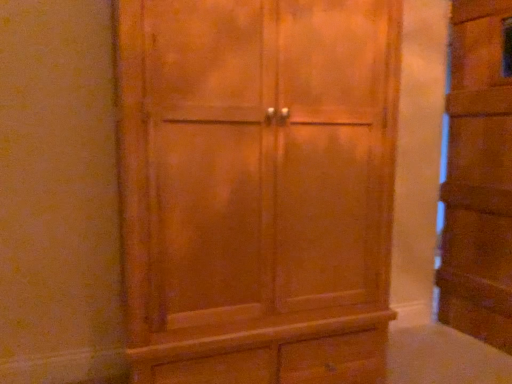
The width and height of the screenshot is (512, 384). Describe the element at coordinates (257, 188) in the screenshot. I see `matte wood cupboard at center, which is counted as the 1th cupboard, starting from the left` at that location.

This screenshot has width=512, height=384. I want to click on matte wood cupboard at center, which is counted as the 1th cupboard, starting from the left, so click(257, 188).

What is the approximate width of matte wood cupboard at center, which is counted as the 1th cupboard, starting from the left?

The width of matte wood cupboard at center, which is counted as the 1th cupboard, starting from the left, is 24.07 inches.

What is the approximate height of wooden cabinet at right, placed as the 1th cupboard when sorted from right to left?

wooden cabinet at right, placed as the 1th cupboard when sorted from right to left, is 1.79 meters in height.

You are a GUI agent. You are given a task and a screenshot of the screen. Output one action in this format:
    pyautogui.click(x=<x>, y=<y>)
    Task: Click on the wooden cabinet at right, placed as the second cupboard when sorted from left to right
    This screenshot has height=384, width=512.
    Given the screenshot: What is the action you would take?
    pyautogui.click(x=479, y=176)

This screenshot has height=384, width=512. What do you see at coordinates (479, 176) in the screenshot?
I see `wooden cabinet at right, placed as the second cupboard when sorted from left to right` at bounding box center [479, 176].

Identify the location of matte wood cupboard at center, acting as the 2th cupboard starting from the right. The height and width of the screenshot is (384, 512). (257, 188).

Can you confirm if matte wood cupboard at center, which is counted as the 1th cupboard, starting from the left, is positioned to the left of wooden cabinet at right, placed as the 1th cupboard when sorted from right to left?

Correct, you'll find matte wood cupboard at center, which is counted as the 1th cupboard, starting from the left, to the left of wooden cabinet at right, placed as the 1th cupboard when sorted from right to left.

Who is more distant, matte wood cupboard at center, which is counted as the 1th cupboard, starting from the left, or wooden cabinet at right, placed as the 1th cupboard when sorted from right to left?

wooden cabinet at right, placed as the 1th cupboard when sorted from right to left.

Does point (362, 56) come in front of point (498, 97)?

Yes, it is in front of point (498, 97).

From the image's perspective, which is below, matte wood cupboard at center, which is counted as the 1th cupboard, starting from the left, or wooden cabinet at right, placed as the second cupboard when sorted from left to right?

matte wood cupboard at center, which is counted as the 1th cupboard, starting from the left, is shown below in the image.

From a real-world perspective, is matte wood cupboard at center, which is counted as the 1th cupboard, starting from the left, on wooden cabinet at right, placed as the 1th cupboard when sorted from right to left?

Incorrect, from a real-world perspective, matte wood cupboard at center, which is counted as the 1th cupboard, starting from the left, is lower than wooden cabinet at right, placed as the 1th cupboard when sorted from right to left.

In terms of width, does matte wood cupboard at center, acting as the 2th cupboard starting from the right, look wider or thinner when compared to wooden cabinet at right, placed as the second cupboard when sorted from left to right?

Considering their sizes, matte wood cupboard at center, acting as the 2th cupboard starting from the right, looks broader than wooden cabinet at right, placed as the second cupboard when sorted from left to right.

Considering the relative sizes of matte wood cupboard at center, acting as the 2th cupboard starting from the right, and wooden cabinet at right, placed as the 1th cupboard when sorted from right to left, in the image provided, is matte wood cupboard at center, acting as the 2th cupboard starting from the right, shorter than wooden cabinet at right, placed as the 1th cupboard when sorted from right to left,?

Yes.

Considering the relative sizes of matte wood cupboard at center, acting as the 2th cupboard starting from the right, and wooden cabinet at right, placed as the 1th cupboard when sorted from right to left, in the image provided, is matte wood cupboard at center, acting as the 2th cupboard starting from the right, bigger than wooden cabinet at right, placed as the 1th cupboard when sorted from right to left,?

Correct, matte wood cupboard at center, acting as the 2th cupboard starting from the right, is larger in size than wooden cabinet at right, placed as the 1th cupboard when sorted from right to left.

Is matte wood cupboard at center, which is counted as the 1th cupboard, starting from the left, positioned beyond the bounds of wooden cabinet at right, placed as the 1th cupboard when sorted from right to left?

Yes.

From the picture: Are matte wood cupboard at center, which is counted as the 1th cupboard, starting from the left, and wooden cabinet at right, placed as the 1th cupboard when sorted from right to left, far apart?

Yes, matte wood cupboard at center, which is counted as the 1th cupboard, starting from the left, and wooden cabinet at right, placed as the 1th cupboard when sorted from right to left, are located far from each other.

Is matte wood cupboard at center, acting as the 2th cupboard starting from the right, facing away from wooden cabinet at right, placed as the 1th cupboard when sorted from right to left?

No, wooden cabinet at right, placed as the 1th cupboard when sorted from right to left, is not at the back of matte wood cupboard at center, acting as the 2th cupboard starting from the right.

How many degrees apart are the facing directions of matte wood cupboard at center, acting as the 2th cupboard starting from the right, and wooden cabinet at right, placed as the 1th cupboard when sorted from right to left?

There is a 81.9-degree angle between the facing directions of matte wood cupboard at center, acting as the 2th cupboard starting from the right, and wooden cabinet at right, placed as the 1th cupboard when sorted from right to left.

What are the coordinates of `cupboard above the matte wood cupboard at center, which is counted as the 1th cupboard, starting from the left (from a real-world perspective)` in the screenshot? It's located at (479, 176).

Which object is positioned more to the right, wooden cabinet at right, placed as the second cupboard when sorted from left to right, or matte wood cupboard at center, acting as the 2th cupboard starting from the right?

From the viewer's perspective, wooden cabinet at right, placed as the second cupboard when sorted from left to right, appears more on the right side.

Which object is more forward, wooden cabinet at right, placed as the 1th cupboard when sorted from right to left, or matte wood cupboard at center, acting as the 2th cupboard starting from the right?

matte wood cupboard at center, acting as the 2th cupboard starting from the right, is closer to the camera.

Is point (462, 306) positioned in front of point (291, 132)?

That is False.

From the image's perspective, is wooden cabinet at right, placed as the second cupboard when sorted from left to right, located above or below matte wood cupboard at center, acting as the 2th cupboard starting from the right?

wooden cabinet at right, placed as the second cupboard when sorted from left to right, is above matte wood cupboard at center, acting as the 2th cupboard starting from the right.

From a real-world perspective, is wooden cabinet at right, placed as the 1th cupboard when sorted from right to left, physically below matte wood cupboard at center, which is counted as the 1th cupboard, starting from the left?

No, from a real-world perspective, wooden cabinet at right, placed as the 1th cupboard when sorted from right to left, is not beneath matte wood cupboard at center, which is counted as the 1th cupboard, starting from the left.

Considering the sizes of objects wooden cabinet at right, placed as the second cupboard when sorted from left to right, and matte wood cupboard at center, which is counted as the 1th cupboard, starting from the left, in the image provided, who is wider, wooden cabinet at right, placed as the second cupboard when sorted from left to right, or matte wood cupboard at center, which is counted as the 1th cupboard, starting from the left,?

With larger width is matte wood cupboard at center, which is counted as the 1th cupboard, starting from the left.

Who is taller, wooden cabinet at right, placed as the second cupboard when sorted from left to right, or matte wood cupboard at center, which is counted as the 1th cupboard, starting from the left?

With more height is wooden cabinet at right, placed as the second cupboard when sorted from left to right.

Does wooden cabinet at right, placed as the 1th cupboard when sorted from right to left, have a smaller size compared to matte wood cupboard at center, acting as the 2th cupboard starting from the right?

Yes, wooden cabinet at right, placed as the 1th cupboard when sorted from right to left, is smaller than matte wood cupboard at center, acting as the 2th cupboard starting from the right.

Based on the photo, is wooden cabinet at right, placed as the 1th cupboard when sorted from right to left, spatially inside matte wood cupboard at center, acting as the 2th cupboard starting from the right, or outside of it?

wooden cabinet at right, placed as the 1th cupboard when sorted from right to left, is not inside matte wood cupboard at center, acting as the 2th cupboard starting from the right, it's outside.

Is wooden cabinet at right, placed as the second cupboard when sorted from left to right, not close to matte wood cupboard at center, acting as the 2th cupboard starting from the right?

Absolutely, wooden cabinet at right, placed as the second cupboard when sorted from left to right, is distant from matte wood cupboard at center, acting as the 2th cupboard starting from the right.

Is wooden cabinet at right, placed as the 1th cupboard when sorted from right to left, oriented away from matte wood cupboard at center, which is counted as the 1th cupboard, starting from the left?

No.

This screenshot has width=512, height=384. I want to click on cupboard beneath the wooden cabinet at right, placed as the 1th cupboard when sorted from right to left (from a real-world perspective), so click(x=257, y=188).

In order to click on cupboard that is below the wooden cabinet at right, placed as the second cupboard when sorted from left to right (from the image's perspective) in this screenshot , I will do `click(257, 188)`.

This screenshot has width=512, height=384. Identify the location of cupboard in front of the wooden cabinet at right, placed as the 1th cupboard when sorted from right to left. (257, 188).